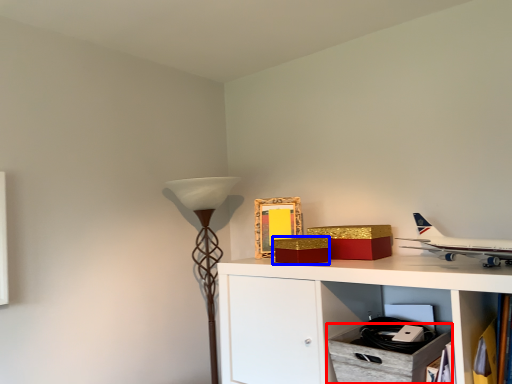
Question: Among these objects, which one is nearest to the camera, drawer (highlighted by a red box) or box (highlighted by a blue box)?

Choices:
 (A) drawer
 (B) box

Answer: (A)